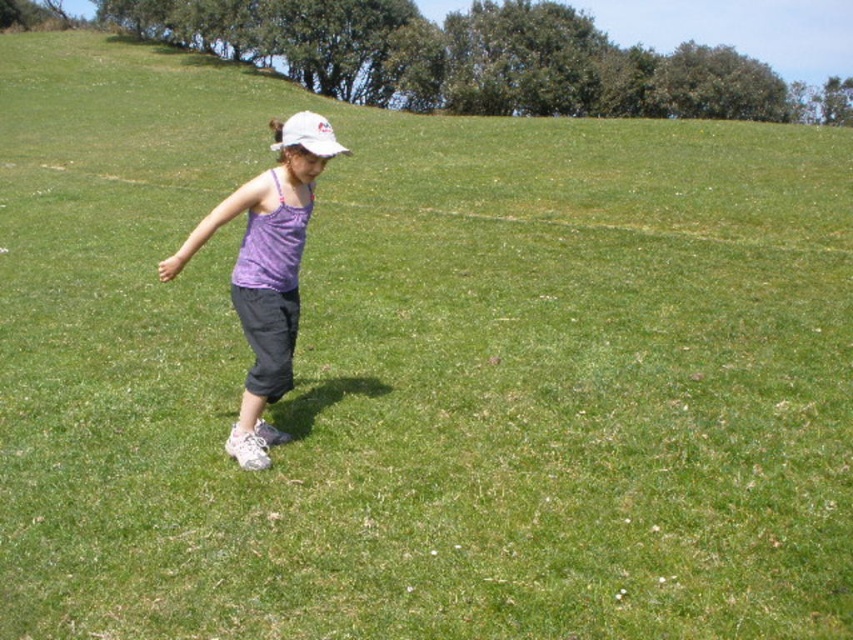
Can you confirm if purple fabric tank top at center is positioned to the right of white matte baseball hat at center?

Yes, purple fabric tank top at center is to the right of white matte baseball hat at center.

Who is more forward, (332,145) or (305,144)?

Positioned in front is point (305,144).

Locate an element on the screen. The width and height of the screenshot is (853, 640). purple fabric tank top at center is located at coordinates (267, 269).